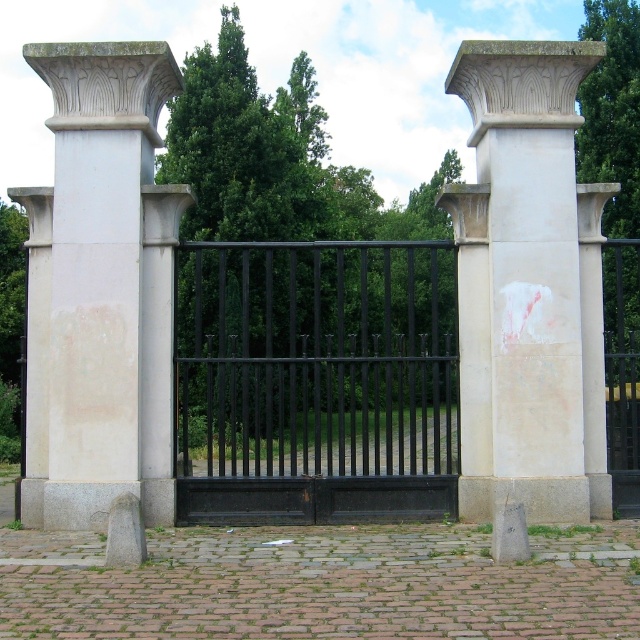
Does white stone column at center have a larger size compared to white stone column at left?

No, white stone column at center is not bigger than white stone column at left.

Which of these two, white stone column at center or white stone column at left, stands taller?

With more height is white stone column at left.

The height and width of the screenshot is (640, 640). Describe the element at coordinates (529, 285) in the screenshot. I see `white stone column at center` at that location.

The height and width of the screenshot is (640, 640). Find the location of `white stone column at center`. white stone column at center is located at coordinates (529, 285).

From the picture: Is black metal fence at center thinner than white stone column at center?

Incorrect, black metal fence at center's width is not less than white stone column at center's.

Who is positioned more to the right, black metal fence at center or white stone column at center?

Positioned to the right is white stone column at center.

The height and width of the screenshot is (640, 640). I want to click on black metal fence at center, so click(316, 381).

Measure the distance from black metal fence at center to white stone column at left.

They are 5.08 meters apart.

Is point (182, 332) positioned before point (163, 328)?

No, (182, 332) is further to viewer.

You are a GUI agent. You are given a task and a screenshot of the screen. Output one action in this format:
    pyautogui.click(x=<x>, y=<y>)
    Task: Click on the black metal fence at center
    This screenshot has height=640, width=640.
    Given the screenshot: What is the action you would take?
    pyautogui.click(x=316, y=381)